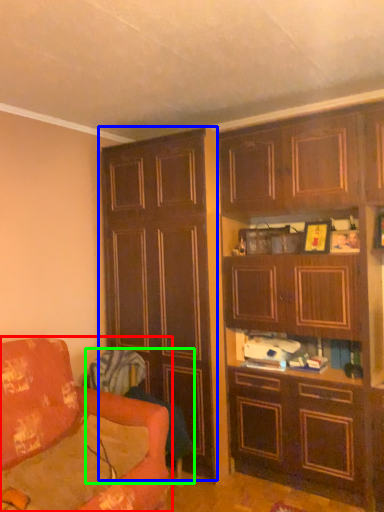
Question: Which is farther away from studio couch (highlighted by a red box)? cabinetry (highlighted by a blue box) or swivel chair (highlighted by a green box)?

Choices:
 (A) cabinetry
 (B) swivel chair

Answer: (A)